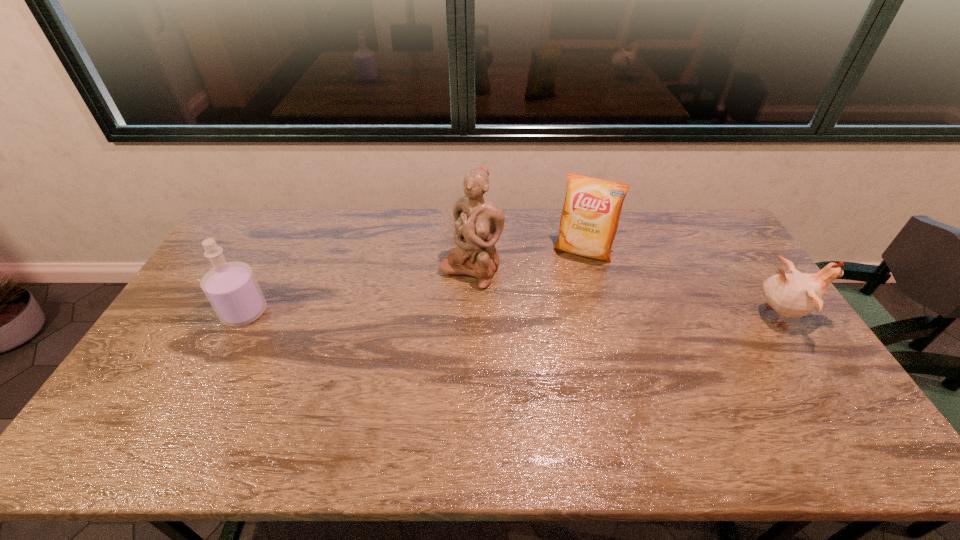
In order to click on free point between the second object from left to right and the shortest object in this screenshot , I will do `click(625, 293)`.

The width and height of the screenshot is (960, 540). I want to click on free space between the figurine and the leftmost object, so [x=358, y=291].

Where is `empty location between the third object from right to left and the perfume`? empty location between the third object from right to left and the perfume is located at coordinates (358, 291).

This screenshot has width=960, height=540. Find the location of `object that is the third nearest to the third object from left to right`. object that is the third nearest to the third object from left to right is located at coordinates (231, 287).

Choose which object is the nearest neighbor to the second object from right to left. Please provide its 2D coordinates. Your answer should be formatted as a tuple, i.e. [(x, y)], where the tuple contains the x and y coordinates of a point satisfying the conditions above.

[(479, 223)]

Identify the location of vacant space that satisfies the following two spatial constraints: 1. on the front side of the perfume; 2. at the beak of the shortest object. Image resolution: width=960 pixels, height=540 pixels. (243, 316).

You are a GUI agent. You are given a task and a screenshot of the screen. Output one action in this format:
    pyautogui.click(x=<x>, y=<y>)
    Task: Click on the vacant space that satisfies the following two spatial constraints: 1. on the back side of the figurine; 2. on the right side of the perfume
    The width and height of the screenshot is (960, 540).
    Given the screenshot: What is the action you would take?
    pyautogui.click(x=267, y=270)

Image resolution: width=960 pixels, height=540 pixels. In order to click on vacant space that satisfies the following two spatial constraints: 1. on the front side of the second object from right to left; 2. at the beak of the bird in this screenshot , I will do (600, 316).

Locate an element on the screen. The width and height of the screenshot is (960, 540). vacant region that satisfies the following two spatial constraints: 1. on the back side of the perfume; 2. on the left side of the tallest object is located at coordinates point(267,270).

Identify the location of vacant point that satisfies the following two spatial constraints: 1. on the back side of the perfume; 2. on the right side of the crisp (potato chip). This screenshot has width=960, height=540. (276, 252).